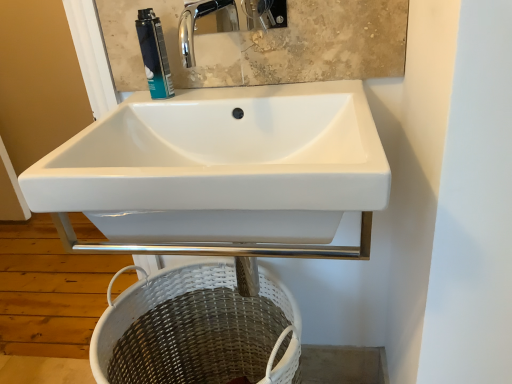
Question: Is white wicker basket at lower center not within blue metallic can at upper center?

Choices:
 (A) no
 (B) yes

Answer: (B)

Question: Is white wicker basket at lower center at the left side of blue metallic can at upper center?

Choices:
 (A) no
 (B) yes

Answer: (A)

Question: Can you confirm if white wicker basket at lower center is taller than blue metallic can at upper center?

Choices:
 (A) yes
 (B) no

Answer: (A)

Question: Considering the relative sizes of white wicker basket at lower center and blue metallic can at upper center in the image provided, is white wicker basket at lower center bigger than blue metallic can at upper center?

Choices:
 (A) yes
 (B) no

Answer: (A)

Question: From a real-world perspective, is white wicker basket at lower center located higher than blue metallic can at upper center?

Choices:
 (A) no
 (B) yes

Answer: (A)

Question: From a real-world perspective, is white glossy sink at center positioned above or below blue metallic can at upper center?

Choices:
 (A) above
 (B) below

Answer: (B)

Question: In the image, is white glossy sink at center on the left side or the right side of blue metallic can at upper center?

Choices:
 (A) right
 (B) left

Answer: (A)

Question: In the image, is white glossy sink at center positioned in front of or behind blue metallic can at upper center?

Choices:
 (A) behind
 (B) front

Answer: (B)

Question: From the image's perspective, is white glossy sink at center positioned above or below blue metallic can at upper center?

Choices:
 (A) below
 (B) above

Answer: (A)

Question: From their relative heights in the image, would you say blue metallic can at upper center is taller or shorter than white wicker basket at lower center?

Choices:
 (A) short
 (B) tall

Answer: (A)

Question: Is point (145, 8) positioned closer to the camera than point (281, 329)?

Choices:
 (A) farther
 (B) closer

Answer: (B)

Question: Considering the positions of blue metallic can at upper center and white wicker basket at lower center in the image, is blue metallic can at upper center wider or thinner than white wicker basket at lower center?

Choices:
 (A) thin
 (B) wide

Answer: (A)

Question: From the image's perspective, is blue metallic can at upper center positioned above or below white wicker basket at lower center?

Choices:
 (A) above
 (B) below

Answer: (A)

Question: Is white glossy sink at center in front of or behind white wicker basket at lower center in the image?

Choices:
 (A) front
 (B) behind

Answer: (A)

Question: From the image's perspective, is white glossy sink at center positioned above or below white wicker basket at lower center?

Choices:
 (A) below
 (B) above

Answer: (B)